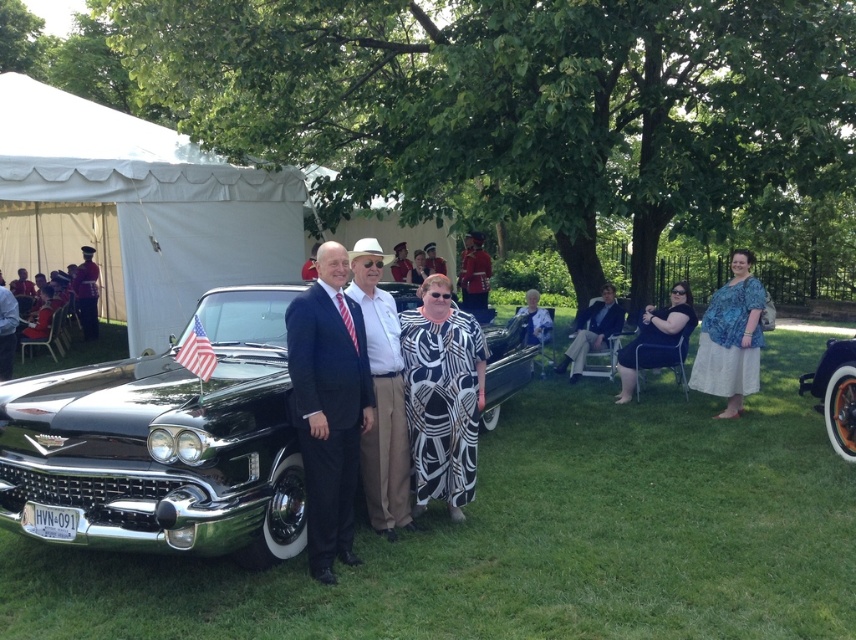
You are a photographer positioned behind the matte black suit at left and want to take a photo of the white fabric tent at upper left. Can you see the entire tent without any obstruction?

The white fabric tent at upper left is further to the viewer than the matte black suit at left, so the matte black suit at left may block your view of the tent.

Looking at this image, you are standing at the event and want to take a photo of both the point at coordinates point (741, 320) and point (467, 244). Which point should you focus on first to ensure both are in focus?

Point (741, 320) is closer to the viewer than point (467, 244), so you should focus on point (741, 320) first to ensure both are in focus.

You are attending an outdoor event and see two people wearing the blue printed blouse at right and the shiny red uniform at center. Which one is lower in position compared to the other?

The blue printed blouse at right is positioned under the shiny red uniform at center, so the blue printed blouse at right is lower in position.